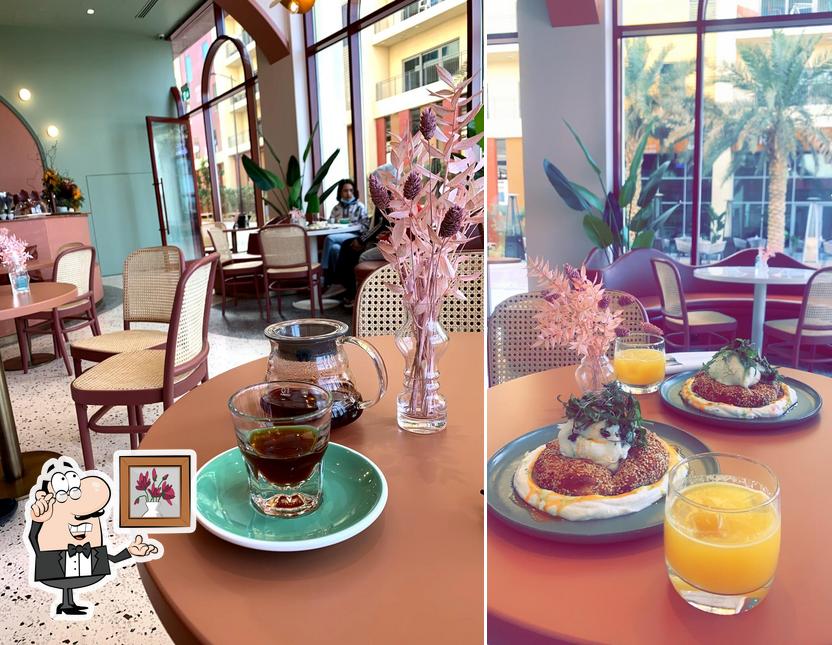
The image size is (832, 645). I want to click on chair, so click(142, 369), click(140, 324), click(83, 264), click(276, 249), click(229, 241), click(210, 229), click(682, 311), click(816, 318), click(380, 301).